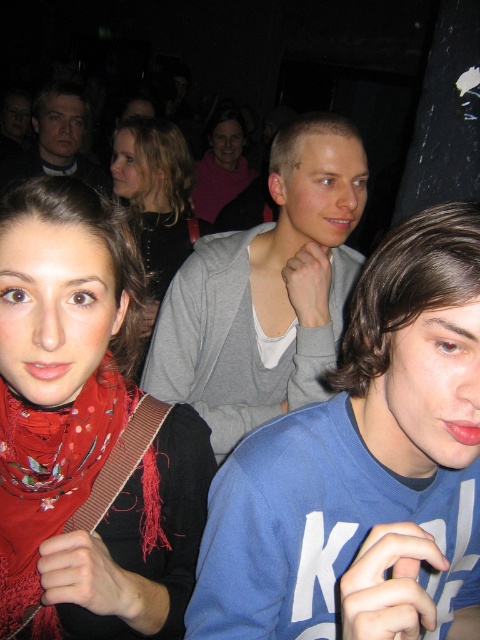
Question: Which point is farther to the camera?

Choices:
 (A) (154, 312)
 (B) (92, 480)

Answer: (A)

Question: Is red scarf at center to the left of red floral scarf at lower left from the viewer's perspective?

Choices:
 (A) no
 (B) yes

Answer: (A)

Question: Can you confirm if blonde hair at center is wider than matte gray sweater at center?

Choices:
 (A) yes
 (B) no

Answer: (B)

Question: Which object appears farthest from the camera in this image?

Choices:
 (A) matte gray sweater at center
 (B) red scarf at center
 (C) gray cotton sweater at center

Answer: (A)

Question: Is red scarf at center in front of blonde hair at center?

Choices:
 (A) yes
 (B) no

Answer: (A)

Question: Which object is farther from the camera taking this photo?

Choices:
 (A) red scarf at center
 (B) blonde hair at center
 (C) blue cotton shirt at center

Answer: (B)